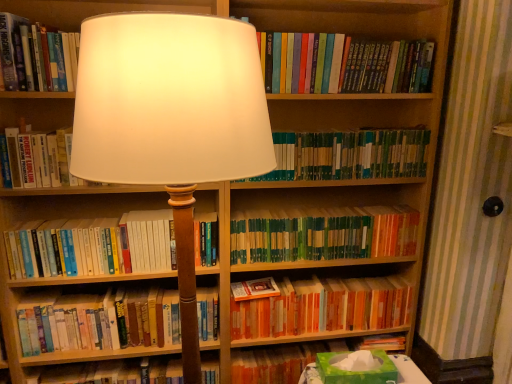
Question: In terms of width, does green matte bookshelf at center, placed as the 4th book when sorted from bottom to top, look wider or thinner when compared to hardcover books at left, which is counted as the 6th book, starting from the top?

Choices:
 (A) wide
 (B) thin

Answer: (B)

Question: From the image's perspective, is green matte bookshelf at center, placed as the 4th book when sorted from bottom to top, located above or below hardcover books at left, the 3th book from the bottom?

Choices:
 (A) above
 (B) below

Answer: (A)

Question: Considering the real-world distances, which object is closest to the white paper book at center, acting as the fourth book starting from the top?

Choices:
 (A) hardcover books at upper center, acting as the 8th book starting from the bottom
 (B) green matte book at center, which ranks as the 6th book in bottom-to-top order
 (C) orange paperbacks at center, the second book when ordered from bottom to top
 (D) hardcover book at center, the 8th book viewed from the top
 (E) matte white lampshade at center

Answer: (D)

Question: Based on their relative distances, which object is farther from the matte white lampshade at center?

Choices:
 (A) hardcover books at left, the 3th book from the bottom
 (B) green matte bookshelf at center, placed as the 4th book when sorted from bottom to top
 (C) white paper book at center, placed as the 5th book when sorted from bottom to top
 (D) hardcover books at upper center, acting as the 8th book starting from the bottom
 (E) hardcover book at center, the 1th book when ordered from bottom to top

Answer: (E)